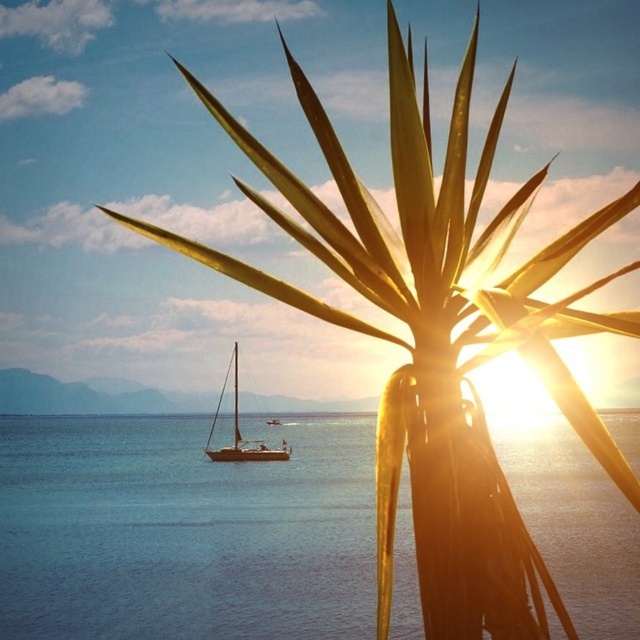
Does blue water at center have a smaller size compared to white glossy sailboat at center?

Incorrect, blue water at center is not smaller in size than white glossy sailboat at center.

Which is above, blue water at center or white glossy sailboat at center?

Positioned higher is white glossy sailboat at center.

In the scene shown: Who is more distant from viewer, (x=529, y=515) or (x=224, y=380)?

The point (x=224, y=380) is more distant.

Where is `blue water at center`? Image resolution: width=640 pixels, height=640 pixels. blue water at center is located at coordinates (182, 532).